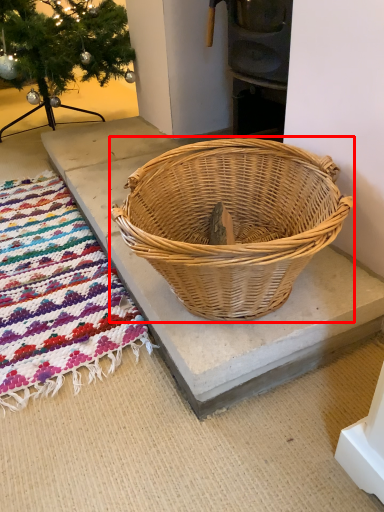
Question: From the image's perspective, where is picnic basket (annotated by the red box) located in relation to mat in the image?

Choices:
 (A) above
 (B) below

Answer: (A)